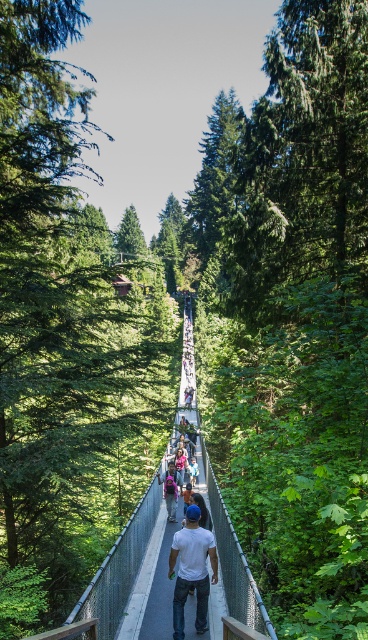
You are standing at the starting point of the suspension bridge and want to reach the point marked as point (168, 461). If your walking speed is 1.5 meters per second, how many seconds will it take you to reach that point?

The distance between you and point (168, 461) is 28.15 meters. At a walking speed of 1.5 meters per second, it will take approximately 18.77 seconds to reach the point. Since the question asks for seconds, rounding to the nearest whole number gives about 19 seconds.

Consider the image. You are a photographer standing on the suspension bridge and notice a person wearing a white matte shirt at center and carrying a matte pink backpack at center. To capture their outfit details clearly, should you adjust your camera focus upwards or downwards?

The white matte shirt at center is located above the matte pink backpack at center, so to focus on the white matte shirt at center, adjust the camera upwards, and for the matte pink backpack at center, adjust downwards.

You are standing on a suspension bridge surrounded by lush greenery. You see a matte pink backpack at center. Can you confirm its exact location using coordinates?

The matte pink backpack at center is located at coordinates point (170, 490).